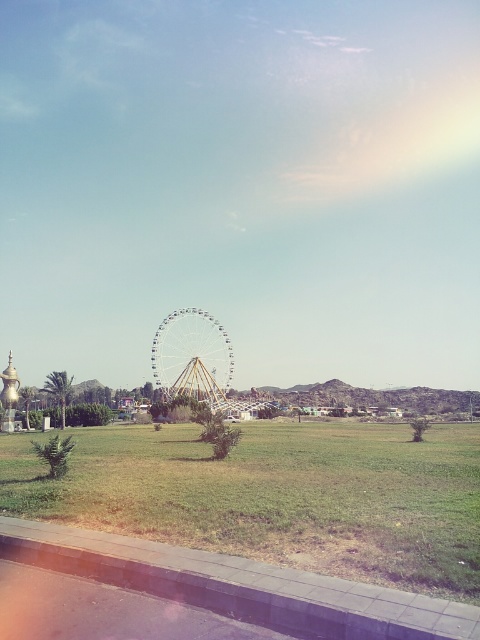
Who is positioned more to the left, green grassy field at center or white metallic ferris wheel at center?

white metallic ferris wheel at center is more to the left.

Does green grassy field at center have a greater height compared to white metallic ferris wheel at center?

Incorrect, green grassy field at center's height is not larger of white metallic ferris wheel at center's.

Where is `green grassy field at center`? The width and height of the screenshot is (480, 640). green grassy field at center is located at coordinates (276, 496).

Locate an element on the screen. This screenshot has width=480, height=640. green grassy field at center is located at coordinates (276, 496).